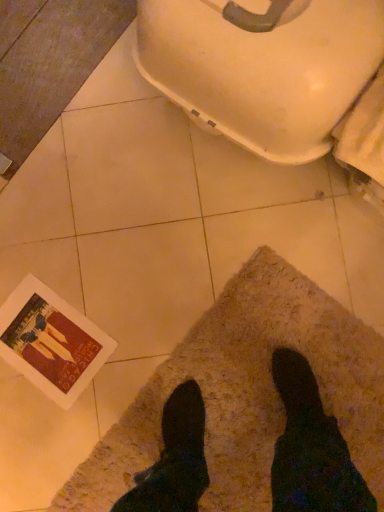
Where is `vacant region under beige shaggy mat at lower center (from a real-world perspective)`? vacant region under beige shaggy mat at lower center (from a real-world perspective) is located at coordinates (247, 414).